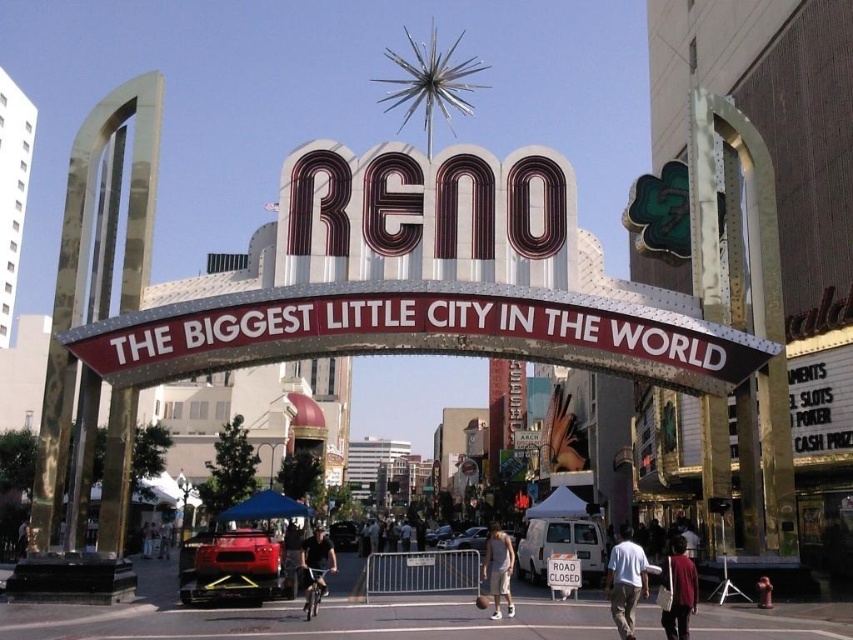
You are a tourist standing in front of the iconic RENO archway. You notice a maroon fabric shirt at lower right and a white plastic road sign at center. Which object appears larger in the scene?

The maroon fabric shirt at lower right appears larger than the white plastic road sign at center.

You are a delivery person needing to carry a 100 feet long pipe from the white cotton shirt at center to the black matte bicycle at center. Can you safely transport it without bending the pipe?

The distance between the white cotton shirt at center and the black matte bicycle at center is 86.59 feet. Since the pipe is 100 feet long, it is longer than the distance between them, so you would need to bend the pipe to fit it through the space between them.

You are standing at the base of the iconic RENO archway and want to take a photo of both the point at coordinates point (628, 602) and point (306, 589). Which point should you focus on first to ensure both are in frame?

You should focus on point (628, 602) first because it is in front of point (306, 589), so capturing it first ensures both are visible in the frame.